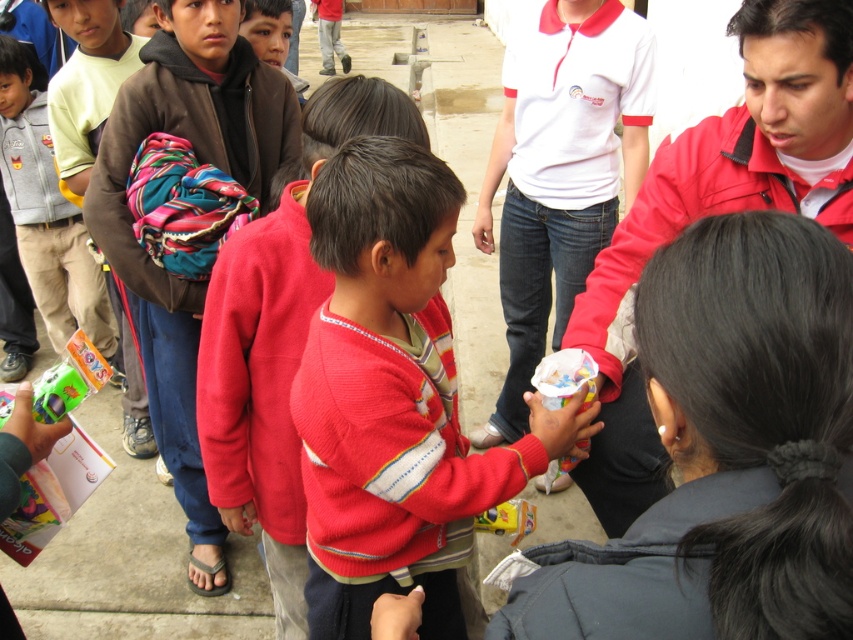
Question: Among these objects, which one is farthest from the camera?

Choices:
 (A) knitted sweater at center
 (B) light brown cotton pants at left
 (C) matte red jacket at center
 (D) brown fleece jacket at upper left

Answer: (B)

Question: Is knitted sweater at center to the right of light brown cotton pants at left from the viewer's perspective?

Choices:
 (A) no
 (B) yes

Answer: (B)

Question: Which point appears closest to the camera in this image?

Choices:
 (A) (363, 131)
 (B) (643, 225)
 (C) (9, 116)
 (D) (173, 403)

Answer: (A)

Question: Is knitted red sweater at center wider than light brown cotton pants at left?

Choices:
 (A) no
 (B) yes

Answer: (B)

Question: Considering the real-world distances, which object is closest to the matte red jacket at center?

Choices:
 (A) knitted red sweater at center
 (B) brown fleece jacket at upper left
 (C) knitted sweater at center

Answer: (A)

Question: Is brown fleece jacket at upper left positioned behind knitted sweater at center?

Choices:
 (A) no
 (B) yes

Answer: (B)